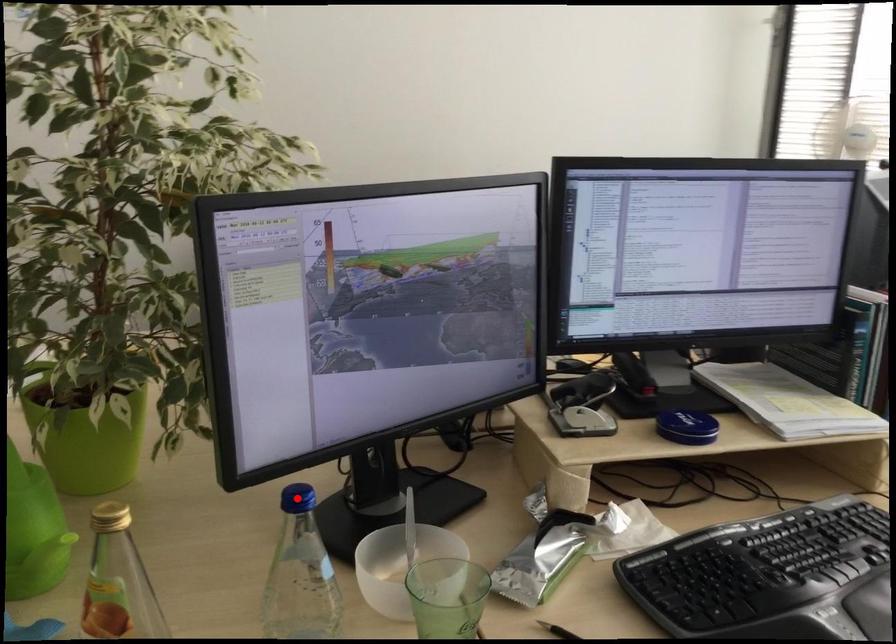
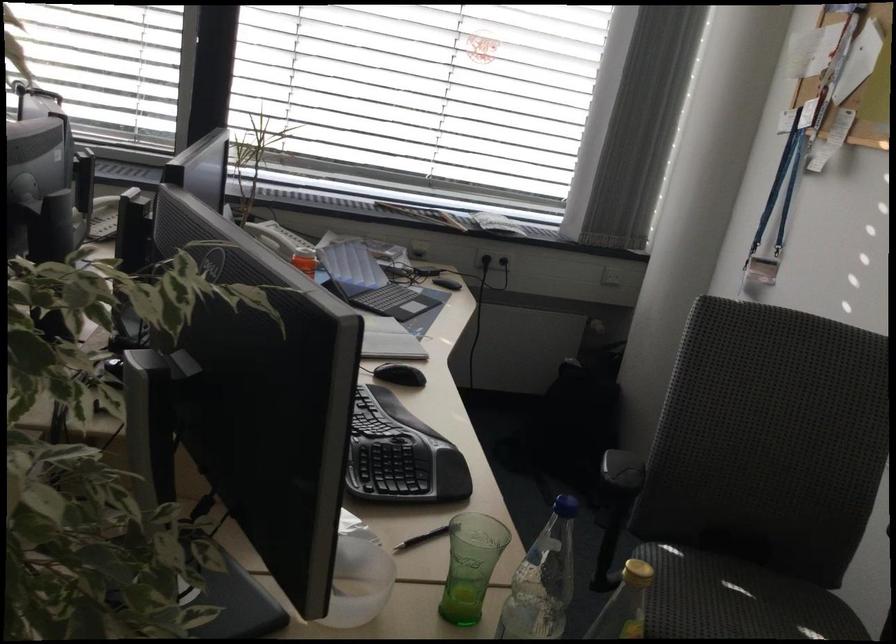
Question: I am providing you with two images of the same scene from different viewpoints. A red point is marked on the first image. At the location where the point appears in image 1, is it still visible in image 2?

Choices:
 (A) Yes
 (B) No

Answer: (B)